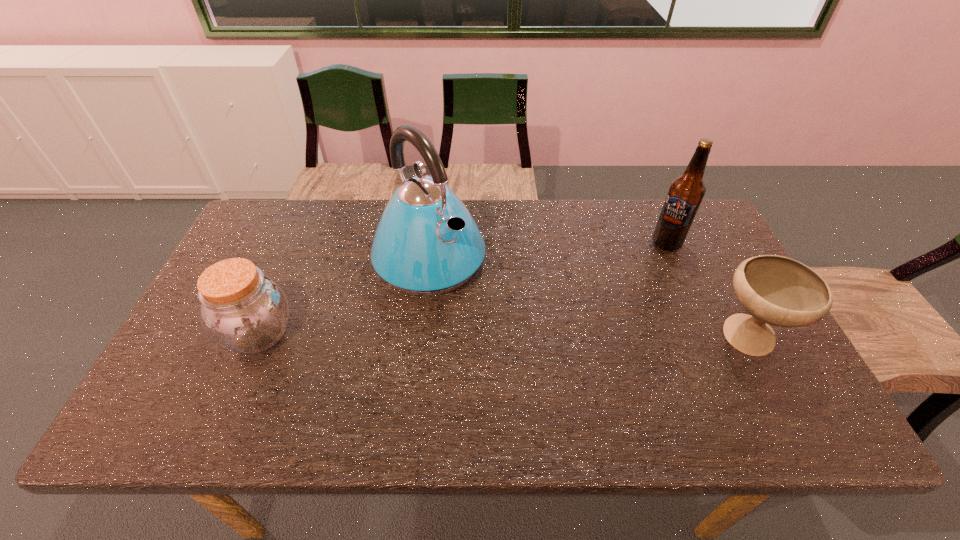
Locate an element on the screen. Image resolution: width=960 pixels, height=540 pixels. unoccupied position between the jar and the chalice is located at coordinates (503, 336).

Find the location of `vacant area between the chalice and the beer bottle`. vacant area between the chalice and the beer bottle is located at coordinates pos(707,291).

I want to click on empty space that is in between the beer bottle and the jar, so click(x=463, y=288).

Identify the location of free space between the beer bottle and the second object from left to right. pyautogui.click(x=548, y=252).

Find the location of a particular element. The image size is (960, 540). vacant area that lies between the chalice and the jar is located at coordinates (503, 336).

This screenshot has width=960, height=540. Find the location of `free space that is in between the kettle and the jar`. free space that is in between the kettle and the jar is located at coordinates (345, 297).

The height and width of the screenshot is (540, 960). Identify the location of vacant region between the leftmost object and the chalice. (503, 336).

The image size is (960, 540). What are the coordinates of `object that stands as the third closest to the third object from right to left` in the screenshot? It's located at (776, 290).

The height and width of the screenshot is (540, 960). Identify the location of the second closest object to the tallest object. (686, 192).

Where is `vacant area in the image that satisfies the following two spatial constraints: 1. on the front side of the chalice; 2. on the left side of the beer bottle`? vacant area in the image that satisfies the following two spatial constraints: 1. on the front side of the chalice; 2. on the left side of the beer bottle is located at coordinates (708, 339).